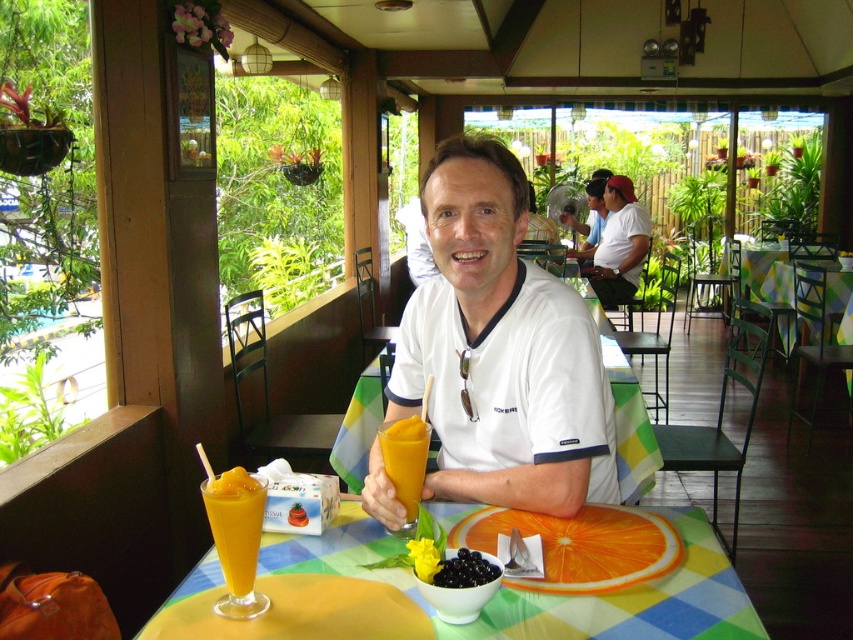
In the scene shown: You are a customer at the outdoor cafe and want to place your phone on the table without it overlapping any other items. Given the white smooth shirt at center and the translucent glass table at center, which object allows more space for placing your phone?

The translucent glass table at center has a greater width compared to the white smooth shirt at center, so placing your phone on the translucent glass table at center would provide more space.

You are a photographer standing at a distance, wanting to capture a closeup shot of the white smooth shirt at center. You have a camera with a zoom lens that can focus up to 1.5 meters. Can you take the closeup without moving closer?

The distance between the white smooth shirt at center and the viewer is 1.24 meters, which is within the camera lens focus range of up to 1.5 meters. Therefore, you can take the closeup without moving closer.